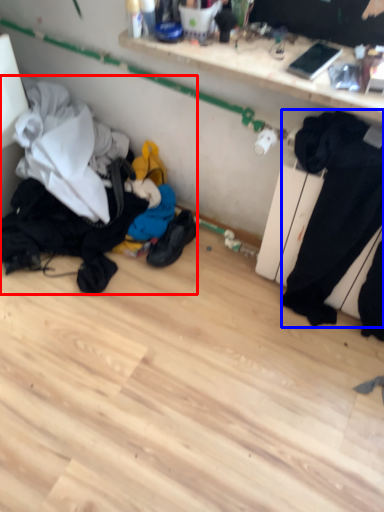
Question: Among these objects, which one is farthest to the camera, laundry (highlighted by a red box) or sweat pant (highlighted by a blue box)?

Choices:
 (A) laundry
 (B) sweat pant

Answer: (A)